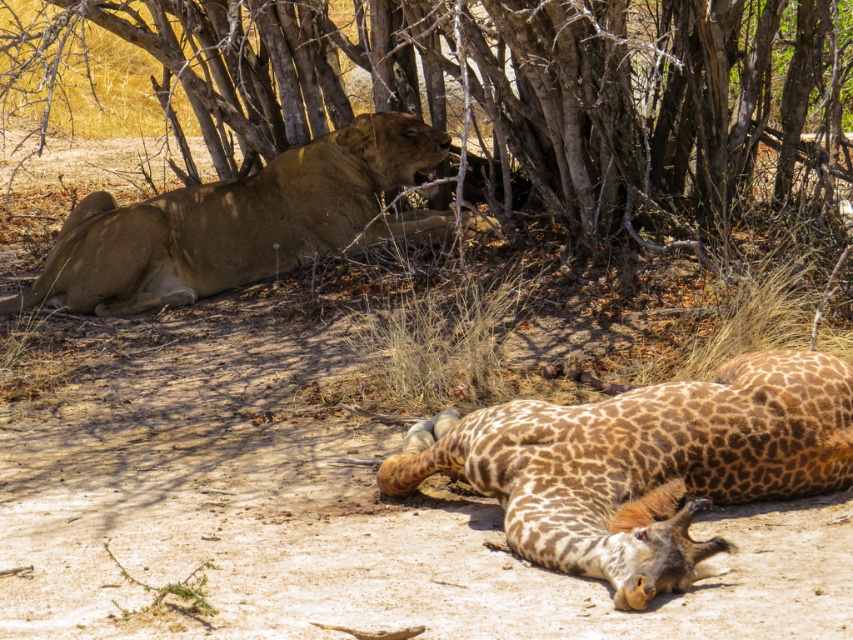
Is golden fur lion at lower right positioned behind golden fur lion at center?

No, golden fur lion at lower right is closer to the viewer.

Locate an element on the screen. The height and width of the screenshot is (640, 853). golden fur lion at lower right is located at coordinates (648, 465).

Which is behind, point (746, 481) or point (97, 307)?

Point (97, 307)

Where is `golden fur lion at lower right`? golden fur lion at lower right is located at coordinates point(648,465).

This screenshot has width=853, height=640. I want to click on brown bark tree at upper center, so click(508, 92).

Does point (482, 112) lie in front of point (115, 220)?

No, (482, 112) is further to viewer.

Does point (44, 115) come behind point (369, 240)?

No.

You are a GUI agent. You are given a task and a screenshot of the screen. Output one action in this format:
    pyautogui.click(x=<x>, y=<y>)
    Task: Click on the brown bark tree at upper center
    The image size is (853, 640).
    Given the screenshot: What is the action you would take?
    pyautogui.click(x=508, y=92)

The height and width of the screenshot is (640, 853). Identify the location of brown bark tree at upper center. (508, 92).

Which is in front, point (639, 8) or point (602, 563)?

Positioned in front is point (602, 563).

Between point (795, 148) and point (465, 454), which one is positioned behind?

Positioned behind is point (795, 148).

Find the location of a particular element. Image resolution: width=853 pixels, height=640 pixels. brown bark tree at upper center is located at coordinates (508, 92).